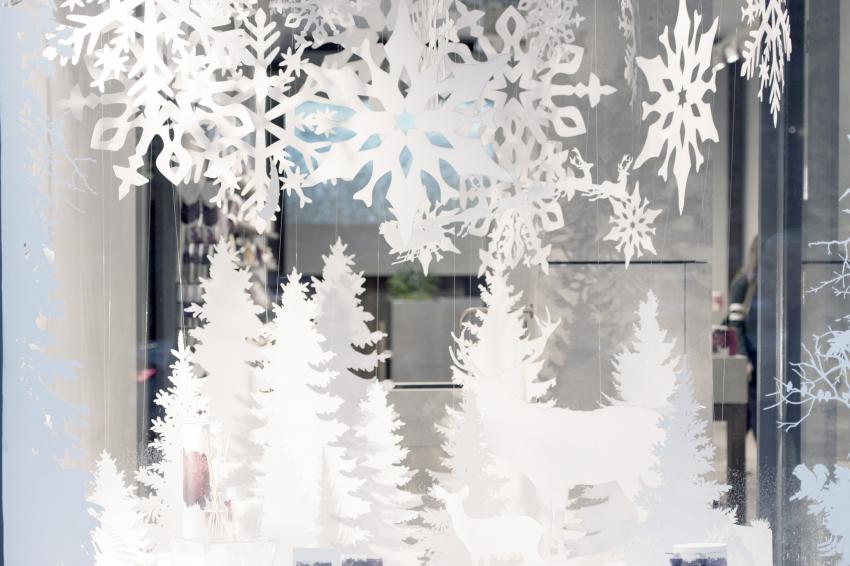
Locate an element on the screen. table legs is located at coordinates (738, 430), (731, 460).